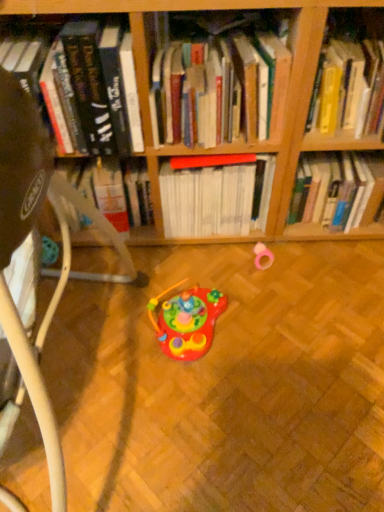
Question: Is white plastic swivel chair at lower left inside yellow hardcover book at upper right, which is the first book in right-to-left order?

Choices:
 (A) yes
 (B) no

Answer: (B)

Question: Considering the relative positions of yellow hardcover book at upper right, which is the first book in right-to-left order, and white plastic swivel chair at lower left in the image provided, is yellow hardcover book at upper right, which is the first book in right-to-left order, to the left of white plastic swivel chair at lower left from the viewer's perspective?

Choices:
 (A) yes
 (B) no

Answer: (B)

Question: Is yellow hardcover book at upper right, the 4th book viewed from the left, outside white plastic swivel chair at lower left?

Choices:
 (A) yes
 (B) no

Answer: (A)

Question: From a real-world perspective, is yellow hardcover book at upper right, the 4th book viewed from the left, below white plastic swivel chair at lower left?

Choices:
 (A) yes
 (B) no

Answer: (B)

Question: Could you tell me if yellow hardcover book at upper right, which is the first book in right-to-left order, is turned towards white plastic swivel chair at lower left?

Choices:
 (A) yes
 (B) no

Answer: (B)

Question: Is yellow hardcover book at upper right, which is the first book in right-to-left order, further to camera compared to white plastic swivel chair at lower left?

Choices:
 (A) yes
 (B) no

Answer: (A)

Question: Is hardcover books at center, which ranks as the 3th book in right-to-left order, facing towards shiny plastic toy at center, which is the first toy in left-to-right order?

Choices:
 (A) no
 (B) yes

Answer: (A)

Question: Is hardcover books at center, arranged as the 2th book when viewed from the left, behind shiny plastic toy at center, positioned as the 2th toy in back-to-front order?

Choices:
 (A) no
 (B) yes

Answer: (A)

Question: Can you confirm if hardcover books at center, arranged as the 2th book when viewed from the left, is positioned to the left of shiny plastic toy at center, positioned as the 2th toy in back-to-front order?

Choices:
 (A) no
 (B) yes

Answer: (A)

Question: Can you confirm if hardcover books at center, arranged as the 2th book when viewed from the left, is thinner than shiny plastic toy at center, placed as the 2th toy when sorted from right to left?

Choices:
 (A) no
 (B) yes

Answer: (A)

Question: Would you say hardcover books at center, arranged as the 2th book when viewed from the left, is outside shiny plastic toy at center, marked as the 1th toy in a front-to-back arrangement?

Choices:
 (A) yes
 (B) no

Answer: (A)

Question: From the image's perspective, does hardcover books at center, arranged as the 2th book when viewed from the left, appear lower than shiny plastic toy at center, marked as the 1th toy in a front-to-back arrangement?

Choices:
 (A) yes
 (B) no

Answer: (B)

Question: Does white plastic swivel chair at lower left come behind red matte book at center, acting as the 2th book starting from the right?

Choices:
 (A) no
 (B) yes

Answer: (A)